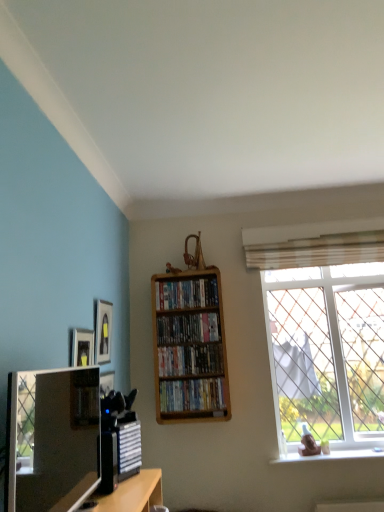
Question: Considering the relative sizes of wooden bookcase at center and matte black picture frame at upper left in the image provided, is wooden bookcase at center taller than matte black picture frame at upper left?

Choices:
 (A) no
 (B) yes

Answer: (B)

Question: From the image's perspective, is wooden bookcase at center beneath matte black picture frame at upper left?

Choices:
 (A) no
 (B) yes

Answer: (B)

Question: Is wooden bookcase at center further to the viewer compared to matte black picture frame at upper left?

Choices:
 (A) no
 (B) yes

Answer: (B)

Question: Is wooden bookcase at center directly adjacent to matte black picture frame at upper left?

Choices:
 (A) yes
 (B) no

Answer: (B)

Question: Is there a large distance between wooden bookcase at center and matte black picture frame at upper left?

Choices:
 (A) yes
 (B) no

Answer: (B)

Question: Is wooden bookcase at center inside the boundaries of clear glass window at right, or outside?

Choices:
 (A) outside
 (B) inside

Answer: (A)

Question: Is wooden bookcase at center taller or shorter than clear glass window at right?

Choices:
 (A) tall
 (B) short

Answer: (B)

Question: From a real-world perspective, relative to clear glass window at right, is wooden bookcase at center vertically above or below?

Choices:
 (A) above
 (B) below

Answer: (A)

Question: Based on their sizes in the image, would you say wooden bookcase at center is bigger or smaller than clear glass window at right?

Choices:
 (A) small
 (B) big

Answer: (A)

Question: Does point (185, 286) appear closer or farther from the camera than point (13, 418)?

Choices:
 (A) closer
 (B) farther

Answer: (B)

Question: From the image's perspective, is wooden shelf at center, which is the fourth book from bottom to top, above or below satin black tv at lower left?

Choices:
 (A) below
 (B) above

Answer: (B)

Question: Considering the relative positions of wooden shelf at center, which is the fourth book from bottom to top, and satin black tv at lower left in the image provided, is wooden shelf at center, which is the fourth book from bottom to top, to the left or to the right of satin black tv at lower left?

Choices:
 (A) left
 (B) right

Answer: (B)

Question: Considering the positions of wooden shelf at center, the 1th book from the top, and satin black tv at lower left in the image, is wooden shelf at center, the 1th book from the top, taller or shorter than satin black tv at lower left?

Choices:
 (A) tall
 (B) short

Answer: (B)

Question: From the image's perspective, is satin black tv at lower left above or below matte black picture frame at upper left?

Choices:
 (A) below
 (B) above

Answer: (A)

Question: Looking at their shapes, would you say satin black tv at lower left is wider or thinner than matte black picture frame at upper left?

Choices:
 (A) thin
 (B) wide

Answer: (B)